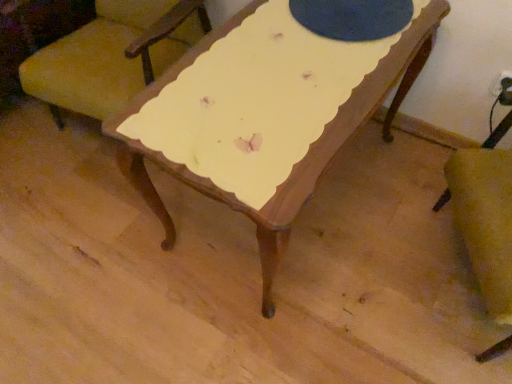
Question: Would you say yellow fabric chair at upper left, the 1th chair in the left-to-right sequence, is part of velvet yellow armchair at lower right, which is the 1th chair from right to left,'s contents?

Choices:
 (A) yes
 (B) no

Answer: (B)

Question: Can you confirm if velvet yellow armchair at lower right, which is the 1th chair from right to left, is positioned to the right of yellow fabric chair at upper left, the second chair in the right-to-left sequence?

Choices:
 (A) yes
 (B) no

Answer: (A)

Question: Can you confirm if velvet yellow armchair at lower right, which is the 1th chair from right to left, is smaller than yellow fabric chair at upper left, the second chair in the right-to-left sequence?

Choices:
 (A) no
 (B) yes

Answer: (B)

Question: From the image's perspective, would you say velvet yellow armchair at lower right, which is the 2th chair in left-to-right order, is positioned over yellow fabric chair at upper left, the second chair in the right-to-left sequence?

Choices:
 (A) no
 (B) yes

Answer: (A)

Question: From a real-world perspective, is velvet yellow armchair at lower right, which is the 2th chair in left-to-right order, over yellow fabric chair at upper left, the 1th chair in the left-to-right sequence?

Choices:
 (A) yes
 (B) no

Answer: (B)

Question: Is velvet yellow armchair at lower right, which is the 1th chair from right to left, further to the viewer compared to yellow fabric chair at upper left, the second chair in the right-to-left sequence?

Choices:
 (A) no
 (B) yes

Answer: (A)

Question: Does yellow fabric chair at upper left, the 1th chair in the left-to-right sequence, have a lesser height compared to velvet yellow armchair at lower right, which is the 1th chair from right to left?

Choices:
 (A) yes
 (B) no

Answer: (A)

Question: From a real-world perspective, is yellow fabric chair at upper left, the 1th chair in the left-to-right sequence, on top of velvet yellow armchair at lower right, which is the 1th chair from right to left?

Choices:
 (A) yes
 (B) no

Answer: (A)

Question: From the image's perspective, is yellow fabric chair at upper left, the 1th chair in the left-to-right sequence, located above velvet yellow armchair at lower right, which is the 2th chair in left-to-right order?

Choices:
 (A) no
 (B) yes

Answer: (B)

Question: Is velvet yellow armchair at lower right, which is the 2th chair in left-to-right order, at the back of yellow fabric chair at upper left, the 1th chair in the left-to-right sequence?

Choices:
 (A) no
 (B) yes

Answer: (A)

Question: Is yellow fabric chair at upper left, the 1th chair in the left-to-right sequence, in front of velvet yellow armchair at lower right, which is the 1th chair from right to left?

Choices:
 (A) no
 (B) yes

Answer: (A)

Question: Is yellow fabric chair at upper left, the second chair in the right-to-left sequence, surrounding velvet yellow armchair at lower right, which is the 1th chair from right to left?

Choices:
 (A) yes
 (B) no

Answer: (B)

Question: Does point (112, 74) appear closer or farther from the camera than point (510, 110)?

Choices:
 (A) farther
 (B) closer

Answer: (B)